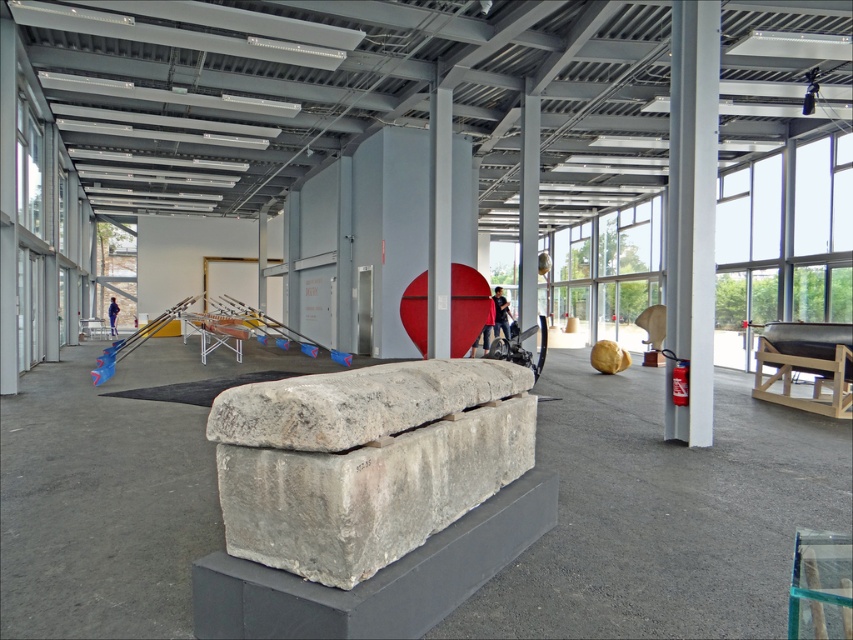
Question: Does black fabric person at center come in front of blue fabric person at center?

Choices:
 (A) no
 (B) yes

Answer: (B)

Question: Is black fabric person at center positioned before blue fabric person at center?

Choices:
 (A) no
 (B) yes

Answer: (B)

Question: Does black fabric person at center lie behind blue fabric person at center?

Choices:
 (A) no
 (B) yes

Answer: (A)

Question: Which of the following is the farthest from the observer?

Choices:
 (A) (109, 317)
 (B) (502, 310)

Answer: (A)